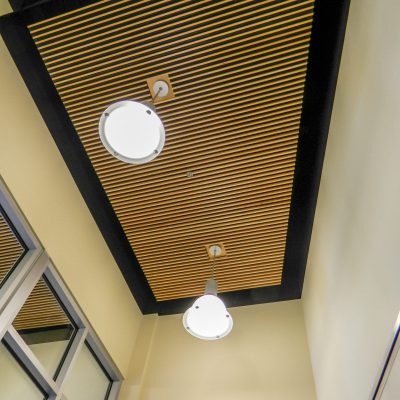
In order to click on light in this screenshot , I will do `click(196, 324)`, `click(133, 132)`.